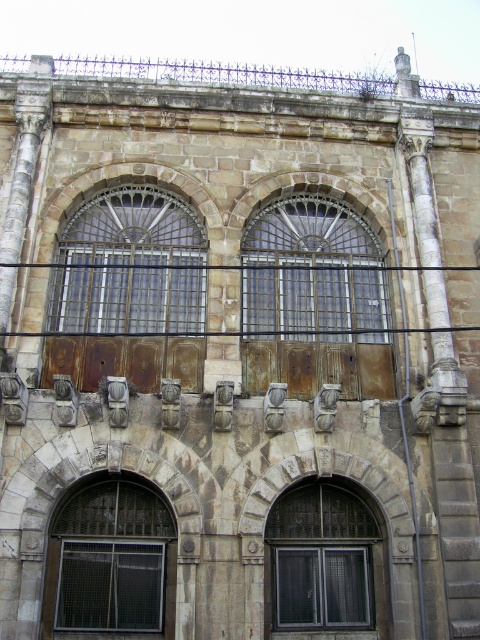
Does rusty metal door at center come in front of matte glass window at center?

No, rusty metal door at center is behind matte glass window at center.

Find the location of a particular element. rusty metal door at center is located at coordinates (131, 264).

Does rusty metal door at center appear on the left side of rusty wood door at center?

Correct, you'll find rusty metal door at center to the left of rusty wood door at center.

Based on the photo, does rusty metal door at center appear under rusty wood door at center?

Actually, rusty metal door at center is above rusty wood door at center.

Find the location of a particular element. Image resolution: width=480 pixels, height=640 pixels. rusty metal door at center is located at coordinates (131, 264).

Locate an element on the screen. rusty metal door at center is located at coordinates (131, 264).

Can you confirm if rusty metal door at center is positioned above dark brown wooden window at lower left?

Correct, rusty metal door at center is located above dark brown wooden window at lower left.

How far apart are rusty metal door at center and dark brown wooden window at lower left?

A distance of 47.81 feet exists between rusty metal door at center and dark brown wooden window at lower left.

You are a GUI agent. You are given a task and a screenshot of the screen. Output one action in this format:
    pyautogui.click(x=<x>, y=<y>)
    Task: Click on the rusty metal door at center
    This screenshot has height=640, width=480.
    Given the screenshot: What is the action you would take?
    pyautogui.click(x=131, y=264)